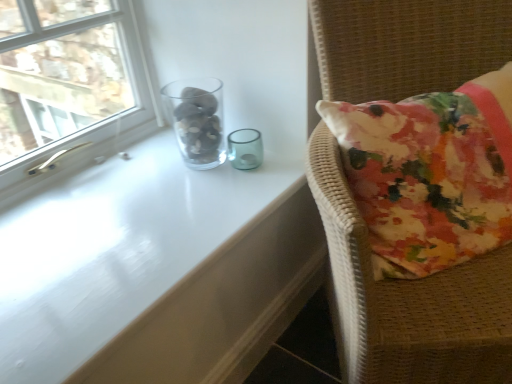
Question: Does floral fabric cushion at right have a lesser height compared to transparent glass table at upper center?

Choices:
 (A) yes
 (B) no

Answer: (B)

Question: Is floral fabric cushion at right not close to transparent glass table at upper center?

Choices:
 (A) no
 (B) yes

Answer: (A)

Question: Does floral fabric cushion at right touch transparent glass table at upper center?

Choices:
 (A) yes
 (B) no

Answer: (B)

Question: Is floral fabric cushion at right to the left of transparent glass table at upper center from the viewer's perspective?

Choices:
 (A) yes
 (B) no

Answer: (B)

Question: Could transparent glass table at upper center be considered to be inside floral fabric cushion at right?

Choices:
 (A) yes
 (B) no

Answer: (B)

Question: From the image's perspective, is transparent glass table at upper center above or below floral fabric cushion at right?

Choices:
 (A) below
 (B) above

Answer: (B)

Question: Would you say transparent glass table at upper center is to the left or to the right of floral fabric cushion at right in the picture?

Choices:
 (A) left
 (B) right

Answer: (A)

Question: Looking at the image, does transparent glass table at upper center seem bigger or smaller compared to floral fabric cushion at right?

Choices:
 (A) big
 (B) small

Answer: (B)

Question: From their relative heights in the image, would you say transparent glass table at upper center is taller or shorter than floral fabric cushion at right?

Choices:
 (A) short
 (B) tall

Answer: (A)

Question: Based on their sizes in the image, would you say floral fabric cushion at right is bigger or smaller than transparent glass vase at upper left?

Choices:
 (A) small
 (B) big

Answer: (B)

Question: From a real-world perspective, is floral fabric cushion at right above or below transparent glass vase at upper left?

Choices:
 (A) below
 (B) above

Answer: (A)

Question: Considering the positions of point (449, 281) and point (202, 115), is point (449, 281) closer or farther from the camera than point (202, 115)?

Choices:
 (A) farther
 (B) closer

Answer: (B)

Question: Considering the positions of floral fabric cushion at right and transparent glass vase at upper left in the image, is floral fabric cushion at right wider or thinner than transparent glass vase at upper left?

Choices:
 (A) wide
 (B) thin

Answer: (A)

Question: Does point (188, 135) appear closer or farther from the camera than point (4, 74)?

Choices:
 (A) farther
 (B) closer

Answer: (B)

Question: In terms of height, does transparent glass vase at upper left look taller or shorter compared to clear glass window at upper left?

Choices:
 (A) tall
 (B) short

Answer: (B)